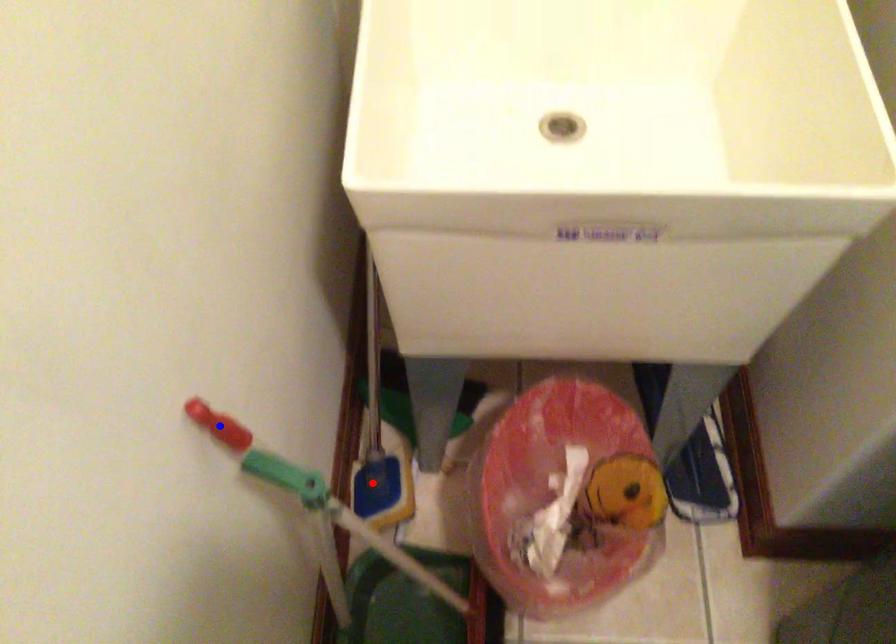
Question: Two points are marked on the image. Which point is closer to the camera?

Choices:
 (A) Blue point is closer.
 (B) Red point is closer.

Answer: (A)